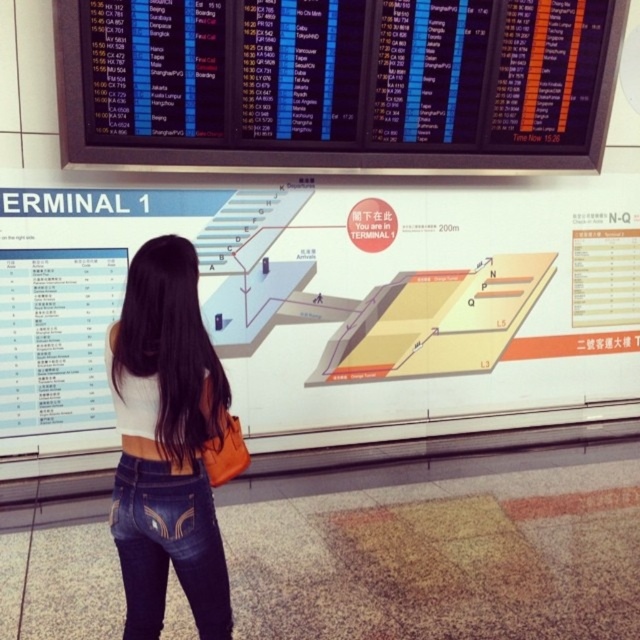
Based on the photo, you are navigating an airport and need to locate two points on the floor plan displayed on the board. The first point is at coordinates point (404, 93) and the second is at point (141, 627). From your perspective standing in front of the board, which point is closer to you?

Point (141, 627) is closer to you because it is in front of point (404, 93).

You are a traveler who just arrived at the airport. You see the black plastic flight information display at upper center and the denim at center. Which object is closer to you?

The black plastic flight information display at upper center is closer to you because the denim at center is behind it.

You are standing in front of the flight information display. Where exactly is the black plastic flight information display at upper center located on the board?

The black plastic flight information display at upper center is located at point (369, 88).